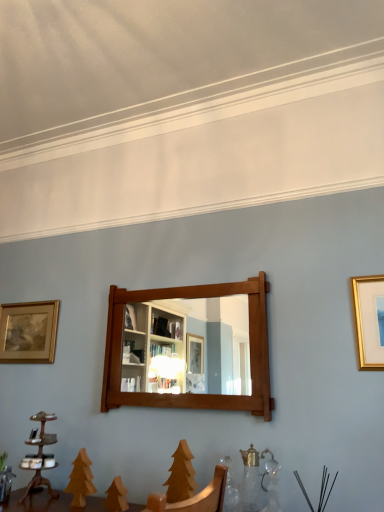
Question: Is gold-framed painting at left, the 1th picture frame in the back-to-front sequence, completely or partially outside of gold metallic picture frame at upper right, acting as the 2th picture frame starting from the back?

Choices:
 (A) no
 (B) yes

Answer: (B)

Question: Does gold-framed painting at left, the 1th picture frame in the back-to-front sequence, have a greater height compared to gold metallic picture frame at upper right, which appears as the first picture frame when viewed from the front?

Choices:
 (A) no
 (B) yes

Answer: (A)

Question: From a real-world perspective, does gold-framed painting at left, the 1th picture frame in the back-to-front sequence, sit lower than gold metallic picture frame at upper right, which appears as the first picture frame when viewed from the front?

Choices:
 (A) yes
 (B) no

Answer: (B)

Question: Does gold-framed painting at left, which is the 1th picture frame in left-to-right order, lie in front of gold metallic picture frame at upper right, arranged as the second picture frame when viewed from the left?

Choices:
 (A) no
 (B) yes

Answer: (A)

Question: Is gold-framed painting at left, the 1th picture frame in the back-to-front sequence, oriented away from gold metallic picture frame at upper right, the 1th picture frame in the right-to-left sequence?

Choices:
 (A) yes
 (B) no

Answer: (B)

Question: In the image, is gold metallic picture frame at upper right, which appears as the first picture frame when viewed from the front, on the left side or the right side of wooden candle holder at lower left?

Choices:
 (A) right
 (B) left

Answer: (A)

Question: Considering their positions, is gold metallic picture frame at upper right, arranged as the second picture frame when viewed from the left, located in front of or behind wooden candle holder at lower left?

Choices:
 (A) front
 (B) behind

Answer: (A)

Question: Is gold metallic picture frame at upper right, acting as the 2th picture frame starting from the back, bigger or smaller than wooden candle holder at lower left?

Choices:
 (A) small
 (B) big

Answer: (A)

Question: Is gold metallic picture frame at upper right, arranged as the second picture frame when viewed from the left, wider or thinner than wooden candle holder at lower left?

Choices:
 (A) wide
 (B) thin

Answer: (B)

Question: In terms of height, does mahogany wooden mirror at center look taller or shorter compared to gold metallic picture frame at upper right, arranged as the second picture frame when viewed from the left?

Choices:
 (A) short
 (B) tall

Answer: (B)

Question: Considering the positions of mahogany wooden mirror at center and gold metallic picture frame at upper right, the 1th picture frame in the right-to-left sequence, in the image, is mahogany wooden mirror at center wider or thinner than gold metallic picture frame at upper right, the 1th picture frame in the right-to-left sequence,?

Choices:
 (A) thin
 (B) wide

Answer: (B)

Question: From the image's perspective, is mahogany wooden mirror at center located above or below gold metallic picture frame at upper right, which appears as the first picture frame when viewed from the front?

Choices:
 (A) below
 (B) above

Answer: (A)

Question: From a real-world perspective, is mahogany wooden mirror at center above or below gold metallic picture frame at upper right, the 1th picture frame in the right-to-left sequence?

Choices:
 (A) above
 (B) below

Answer: (B)

Question: Choose the correct answer: Is gold metallic picture frame at upper right, acting as the 2th picture frame starting from the back, inside mahogany wooden mirror at center or outside it?

Choices:
 (A) outside
 (B) inside

Answer: (A)

Question: In terms of width, does gold metallic picture frame at upper right, arranged as the second picture frame when viewed from the left, look wider or thinner when compared to mahogany wooden mirror at center?

Choices:
 (A) thin
 (B) wide

Answer: (A)